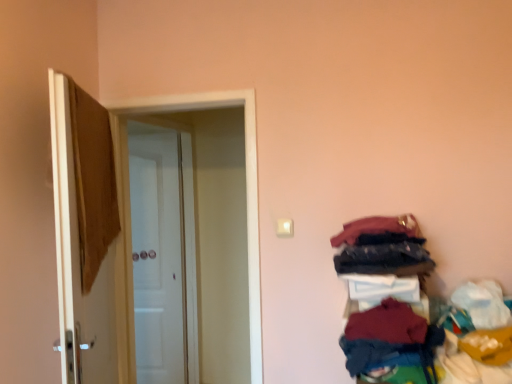
Question: From a real-world perspective, is brown fabric at left, the third door from the back, positioned under dark red fabric at lower right, marked as the 3th clothing in a top-to-bottom arrangement, based on gravity?

Choices:
 (A) yes
 (B) no

Answer: (B)

Question: Does brown fabric at left, the first door positioned from the front, appear on the right side of dark red fabric at lower right, acting as the second clothing starting from the bottom?

Choices:
 (A) yes
 (B) no

Answer: (B)

Question: Can you confirm if brown fabric at left, the first door positioned from the front, is bigger than dark red fabric at lower right, acting as the second clothing starting from the bottom?

Choices:
 (A) yes
 (B) no

Answer: (A)

Question: Is brown fabric at left, the third door from the back, placed right next to dark red fabric at lower right, acting as the second clothing starting from the bottom?

Choices:
 (A) no
 (B) yes

Answer: (A)

Question: Can you confirm if brown fabric at left, the third door from the back, is wider than dark red fabric at lower right, acting as the second clothing starting from the bottom?

Choices:
 (A) no
 (B) yes

Answer: (A)

Question: Considering the relative sizes of brown fabric at left, the third door from the back, and dark red fabric at lower right, acting as the second clothing starting from the bottom, in the image provided, is brown fabric at left, the third door from the back, thinner than dark red fabric at lower right, acting as the second clothing starting from the bottom,?

Choices:
 (A) yes
 (B) no

Answer: (A)

Question: Could you tell me if brown fabric at left, the third door from the back, is turned towards white glossy door at center, the 2th door positioned from the front?

Choices:
 (A) no
 (B) yes

Answer: (B)

Question: Considering the relative sizes of brown fabric at left, the first door positioned from the front, and white glossy door at center, the 2th door positioned from the front, in the image provided, is brown fabric at left, the first door positioned from the front, shorter than white glossy door at center, the 2th door positioned from the front,?

Choices:
 (A) no
 (B) yes

Answer: (B)

Question: Does brown fabric at left, the third door from the back, appear on the right side of white glossy door at center, which is counted as the second door, starting from the back?

Choices:
 (A) yes
 (B) no

Answer: (B)

Question: Considering the relative positions of brown fabric at left, the first door positioned from the front, and white glossy door at center, the 2th door positioned from the front, in the image provided, is brown fabric at left, the first door positioned from the front, behind white glossy door at center, the 2th door positioned from the front,?

Choices:
 (A) yes
 (B) no

Answer: (B)

Question: Is brown fabric at left, the first door positioned from the front, not within white glossy door at center, the 2th door positioned from the front?

Choices:
 (A) yes
 (B) no

Answer: (A)

Question: Can you confirm if brown fabric at left, the third door from the back, is wider than white glossy door at center, which is counted as the second door, starting from the back?

Choices:
 (A) yes
 (B) no

Answer: (B)

Question: Could you tell me if dark red fabric at lower right, marked as the 3th clothing in a top-to-bottom arrangement, is turned towards dark blue fabric at right, the second clothing when ordered from top to bottom?

Choices:
 (A) yes
 (B) no

Answer: (B)